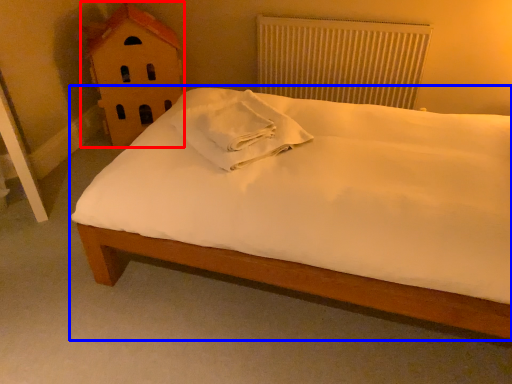
Question: Among these objects, which one is nearest to the camera, toy (highlighted by a red box) or bed (highlighted by a blue box)?

Choices:
 (A) toy
 (B) bed

Answer: (B)